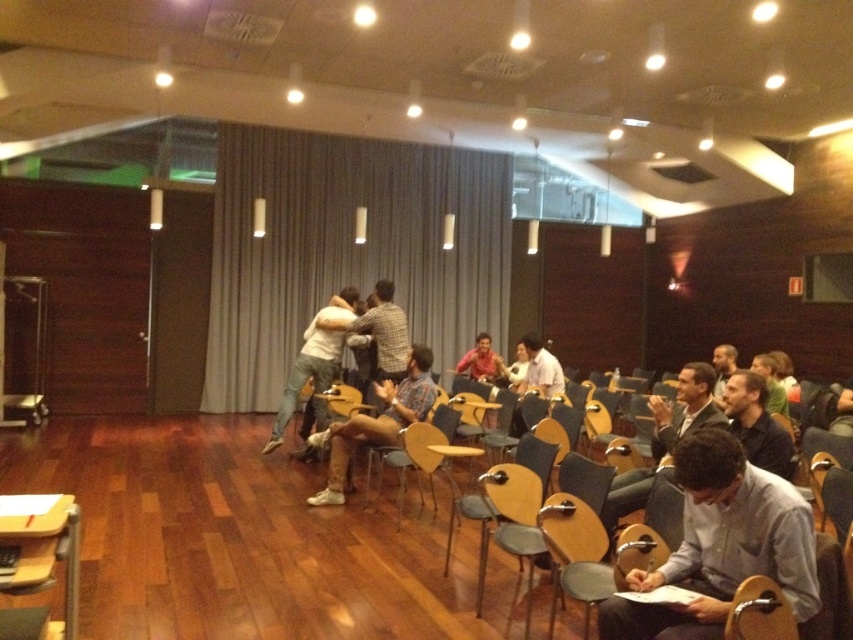
Question: Is light brown wood chair at lower right below light gray jeans at center?

Choices:
 (A) no
 (B) yes

Answer: (B)

Question: Among these points, which one is nearest to the camera?

Choices:
 (A) coord(689,387)
 (B) coord(334,300)
 (C) coord(366,316)
 (D) coord(735,360)

Answer: (A)

Question: Is light brown wood chair at lower right further to camera compared to light gray jeans at center?

Choices:
 (A) yes
 (B) no

Answer: (B)

Question: Which object is farther from the camera taking this photo?

Choices:
 (A) matte red shirt at center
 (B) plaid shirt at center

Answer: (A)

Question: Which point is farther to the camera?

Choices:
 (A) (718, 438)
 (B) (677, 396)
 (C) (479, 376)
 (D) (780, 429)

Answer: (C)

Question: Does white shirt at center have a smaller size compared to matte red shirt at center?

Choices:
 (A) yes
 (B) no

Answer: (A)